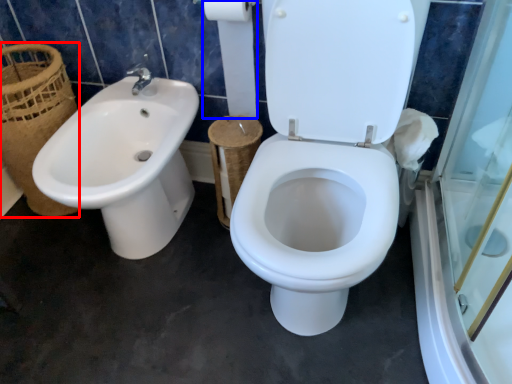
Question: Which object appears closest to the camera in this image, basket (highlighted by a red box) or toilet paper (highlighted by a blue box)?

Choices:
 (A) basket
 (B) toilet paper

Answer: (B)